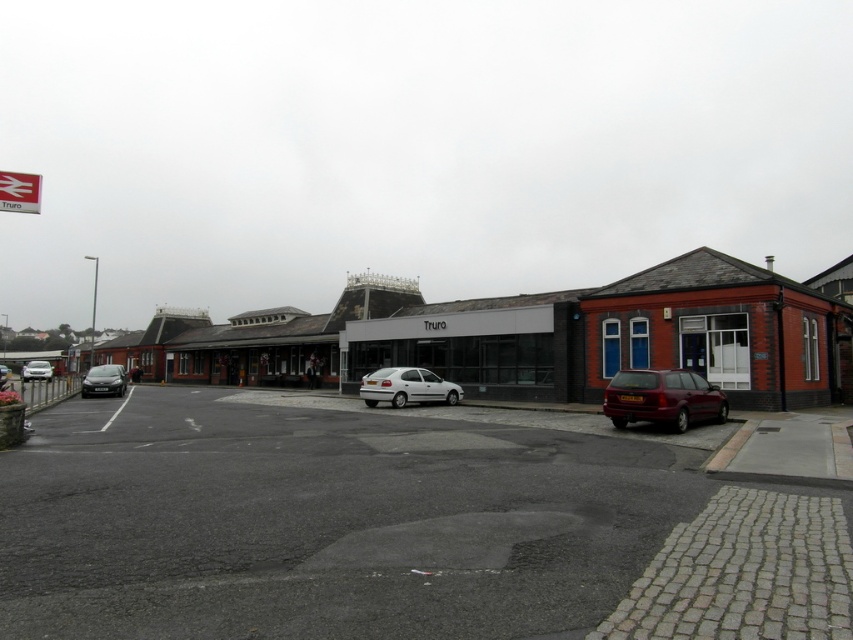
Question: Does shiny black car at left have a smaller size compared to silver metallic car at left?

Choices:
 (A) no
 (B) yes

Answer: (A)

Question: Estimate the real-world distances between objects in this image. Which object is closer to the silver metallic car at left?

Choices:
 (A) white matte hatchback at center
 (B) red brick building at right
 (C) matte black car at center
 (D) shiny black car at left

Answer: (C)

Question: Is white glass building at center to the left of silver metallic car at left from the viewer's perspective?

Choices:
 (A) yes
 (B) no

Answer: (B)

Question: Among these points, which one is farthest from the camera?

Choices:
 (A) pos(33,364)
 (B) pos(373,388)

Answer: (A)

Question: Among these objects, which one is nearest to the camera?

Choices:
 (A) shiny maroon estate car at right
 (B) white matte hatchback at center

Answer: (A)

Question: Is silver metallic car at left bigger than matte black car at center?

Choices:
 (A) no
 (B) yes

Answer: (A)